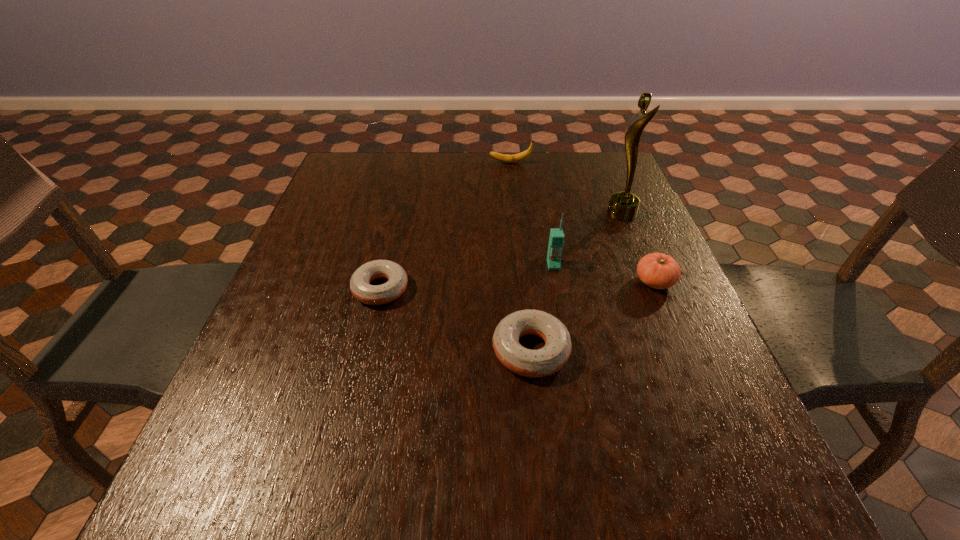
I want to click on object present at the left edge, so point(360,287).

Where is `tomato positioned at the right edge`? The width and height of the screenshot is (960, 540). tomato positioned at the right edge is located at coordinates (657, 270).

This screenshot has width=960, height=540. I want to click on award that is positioned at the right edge, so click(623, 206).

Where is `free space at the far edge of the desktop`? This screenshot has width=960, height=540. free space at the far edge of the desktop is located at coordinates (533, 173).

Where is `vacant space at the near edge of the desktop`? vacant space at the near edge of the desktop is located at coordinates (583, 399).

In the image, there is a desktop. Where is `vacant space at the left edge`? Image resolution: width=960 pixels, height=540 pixels. vacant space at the left edge is located at coordinates click(x=300, y=261).

You are a GUI agent. You are given a task and a screenshot of the screen. Output one action in this format:
    pyautogui.click(x=<x>, y=<y>)
    Task: Click on the vacant space at the right edge
    This screenshot has width=960, height=540.
    Given the screenshot: What is the action you would take?
    pyautogui.click(x=622, y=325)

Locate an element on the screen. Image resolution: width=960 pixels, height=540 pixels. vacant space that is in between the farther doughnut and the nearer doughnut is located at coordinates tap(456, 319).

Where is `empty space between the tomato and the left doughnut`? The image size is (960, 540). empty space between the tomato and the left doughnut is located at coordinates (517, 285).

Image resolution: width=960 pixels, height=540 pixels. I want to click on free space between the fifth shortest object and the left doughnut, so (467, 277).